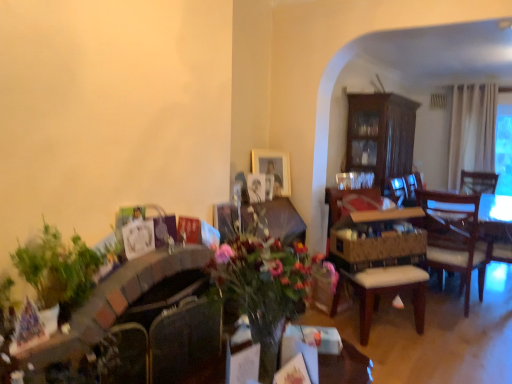
This screenshot has height=384, width=512. Identify the location of wooden armchair at center. (343, 197).

Measure the distance between point (380, 165) and camera.

They are 15.35 feet apart.

At what (x,y) coordinates should I click in order to perform the action: click on green leafy plant at left. Please return your answer as a coordinate pair (x, y). Looking at the image, I should click on (57, 268).

Is gold metallic picture frame at upper center not close to wooden table at center?

That's right, there is a large distance between gold metallic picture frame at upper center and wooden table at center.

At what (x,y) coordinates should I click in order to perform the action: click on table in front of the gold metallic picture frame at upper center. Please return your answer as a coordinate pair (x, y). This screenshot has height=384, width=512. Looking at the image, I should click on (343, 365).

Considering the positions of objects gold metallic picture frame at upper center and wooden table at center in the image provided, who is behind, gold metallic picture frame at upper center or wooden table at center?

gold metallic picture frame at upper center.

From the image's perspective, is gold metallic picture frame at upper center over green leafy plant at left?

Yes.

Considering the relative positions of gold metallic picture frame at upper center and green leafy plant at left in the image provided, is gold metallic picture frame at upper center to the left or to the right of green leafy plant at left?

From the image, it's evident that gold metallic picture frame at upper center is to the right of green leafy plant at left.

Between gold metallic picture frame at upper center and green leafy plant at left, which one has larger size?

With larger size is green leafy plant at left.

Is gold metallic picture frame at upper center next to green leafy plant at left and touching it?

gold metallic picture frame at upper center is not next to green leafy plant at left, and they're not touching.

Is wooden armchair at center facing away from wooden cushioned chair at center?

That's right, wooden armchair at center is facing away from wooden cushioned chair at center.

Would you say wooden armchair at center is inside or outside wooden cushioned chair at center?

wooden armchair at center lies within the bounds of wooden cushioned chair at center.

Which of these two, wooden armchair at center or wooden cushioned chair at center, stands shorter?

wooden armchair at center is shorter.

Which object is wider, wooden armchair at center or wooden cushioned chair at center?

wooden cushioned chair at center is wider.

How many degrees apart are the facing directions of green leafy plant at left and wooden armchair at center?

The facing directions of green leafy plant at left and wooden armchair at center are 37.5 degrees apart.

Would you say green leafy plant at left contains wooden armchair at center?

No, wooden armchair at center is not surrounded by green leafy plant at left.

From a real-world perspective, is green leafy plant at left positioned over wooden armchair at center based on gravity?

Correct, in the physical world, green leafy plant at left is higher than wooden armchair at center.

Is dark wood cabinet at center-right spatially inside wooden table at center, or outside of it?

dark wood cabinet at center-right is spatially situated outside wooden table at center.

Between dark wood cabinet at center-right and wooden table at center, which one appears on the right side from the viewer's perspective?

Positioned to the right is dark wood cabinet at center-right.

Based on the photo, which of these two, dark wood cabinet at center-right or wooden table at center, stands shorter?

wooden table at center.

This screenshot has height=384, width=512. What are the coordinates of `cabinetry on the right of wooden table at center` in the screenshot? It's located at (380, 135).

From a real-world perspective, which is physically below, green leafy plant at left or gold metallic picture frame at upper center?

From a 3D spatial view, green leafy plant at left is below.

Looking at this image, is green leafy plant at left bigger or smaller than gold metallic picture frame at upper center?

Clearly, green leafy plant at left is larger in size than gold metallic picture frame at upper center.

Consider the image. From the image's perspective, between green leafy plant at left and gold metallic picture frame at upper center, who is located below?

green leafy plant at left, from the image's perspective.

From a real-world perspective, is gold metallic picture frame at upper center located beneath transparent glass window screen at upper right?

Yes, from a real-world perspective, gold metallic picture frame at upper center is under transparent glass window screen at upper right.

Who is shorter, gold metallic picture frame at upper center or transparent glass window screen at upper right?

Standing shorter between the two is gold metallic picture frame at upper center.

Does point (280, 187) appear closer or farther from the camera than point (504, 106)?

Point (280, 187).

Is gold metallic picture frame at upper center facing away from transparent glass window screen at upper right?

No.

Locate an element on the screen. This screenshot has width=512, height=384. picture frame above the wooden table at center (from a real-world perspective) is located at coordinates (273, 168).

Locate an element on the screen. The width and height of the screenshot is (512, 384). picture frame on the right of green leafy plant at left is located at coordinates (273, 168).

Considering their positions, is dark wood cabinet at center-right positioned closer to transparent glass window screen at upper right than wooden cushioned chair at center?

dark wood cabinet at center-right lies closer to transparent glass window screen at upper right than the other object.

Based on their spatial positions, is gold metallic picture frame at upper center or wooden armchair at center closer to green leafy plant at left?

The object closer to green leafy plant at left is gold metallic picture frame at upper center.

Based on their spatial positions, is transparent glass window screen at upper right or gold metallic picture frame at upper center further from wooden armchair at center?

Among the two, transparent glass window screen at upper right is located further to wooden armchair at center.

Estimate the real-world distances between objects in this image. Which object is further from gold metallic picture frame at upper center, green leafy plant at left or dark wood cabinet at center-right?

Based on the image, green leafy plant at left appears to be further to gold metallic picture frame at upper center.

When comparing their distances from dark wood cabinet at center-right, does wooden table at center or wooden cushioned chair at center seem closer?

wooden cushioned chair at center is positioned closer to the anchor dark wood cabinet at center-right.

Consider the image. Estimate the real-world distances between objects in this image. Which object is closer to wooden cushioned chair at center, green leafy plant at left or transparent glass window screen at upper right?

green leafy plant at left lies closer to wooden cushioned chair at center than the other object.

Which object lies nearer to the anchor point dark wood cabinet at center-right, wooden armchair at center or wooden table at center?

wooden armchair at center.

Estimate the real-world distances between objects in this image. Which object is further from wooden armchair at center, dark wood cabinet at center-right or wooden cushioned chair at center?

dark wood cabinet at center-right is further to wooden armchair at center.

Identify the location of plant between wooden table at center and gold metallic picture frame at upper center in the front-back direction. (57, 268).

Locate an element on the screen. chair positioned between green leafy plant at left and wooden armchair at center from near to far is located at coordinates (381, 262).

This screenshot has height=384, width=512. In order to click on armchair between green leafy plant at left and gold metallic picture frame at upper center from front to back in this screenshot , I will do `click(343, 197)`.

What are the coordinates of `chair between green leafy plant at left and dark wood cabinet at center-right in the front-back direction` in the screenshot? It's located at (381, 262).